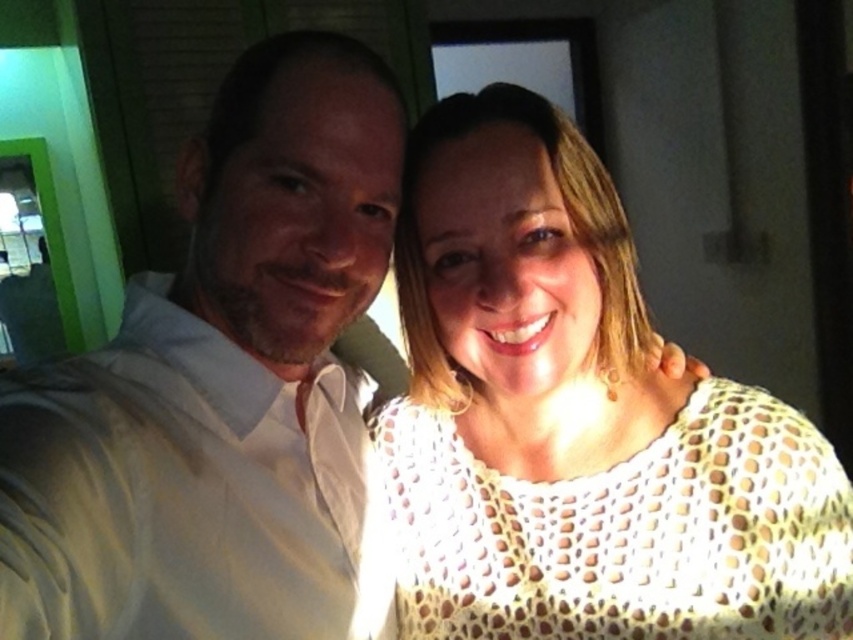
Who is higher up, white crochet top at center or white smooth shirt at left?

white smooth shirt at left is above.

Image resolution: width=853 pixels, height=640 pixels. I want to click on white crochet top at center, so click(579, 419).